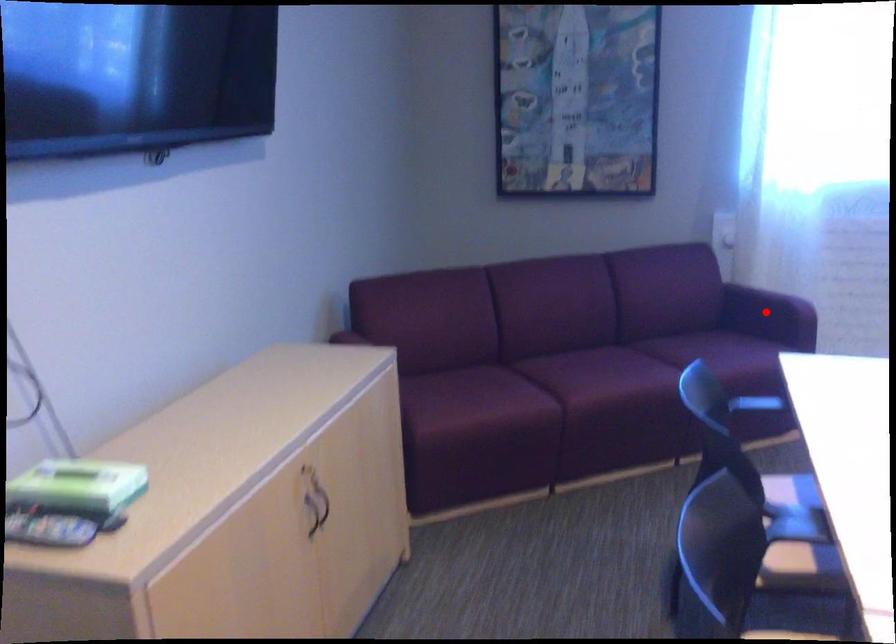
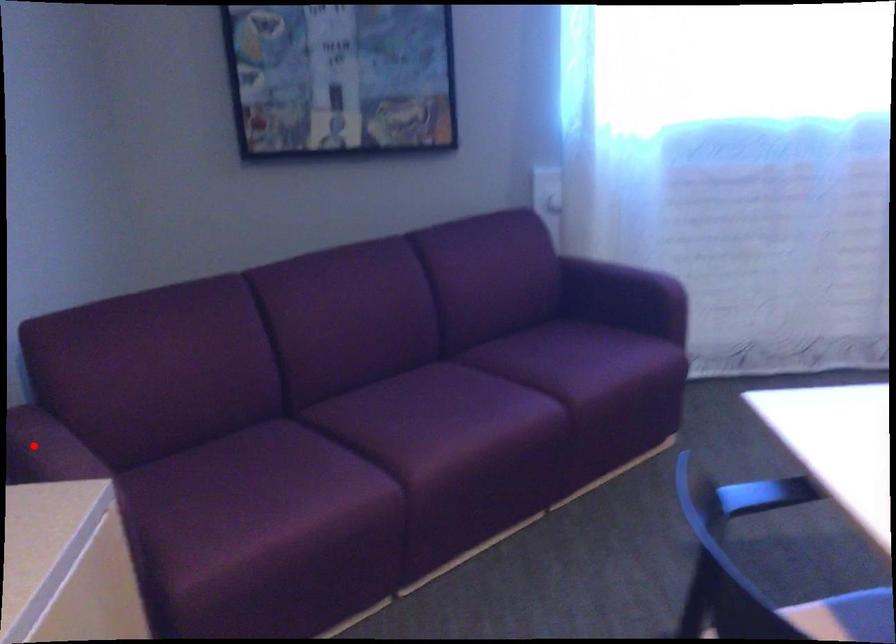
I am providing you with two images of the same scene from different viewpoints. A red point is marked on the first image and another point is marked on the second image. Does the point marked in image1 correspond to the same location as the one in image2?

No